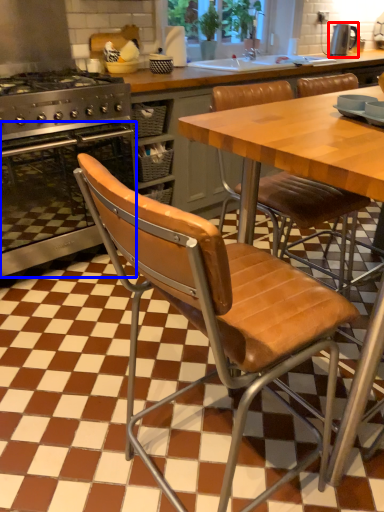
Question: Which object is closer to the camera taking this photo, kitchen appliance (highlighted by a red box) or oven (highlighted by a blue box)?

Choices:
 (A) kitchen appliance
 (B) oven

Answer: (B)